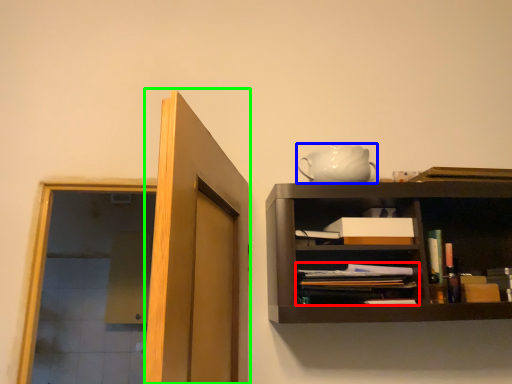
Question: Considering the real-world distances, which object is farthest from book (highlighted by a red box)? tea pot (highlighted by a blue box) or door (highlighted by a green box)?

Choices:
 (A) tea pot
 (B) door

Answer: (B)